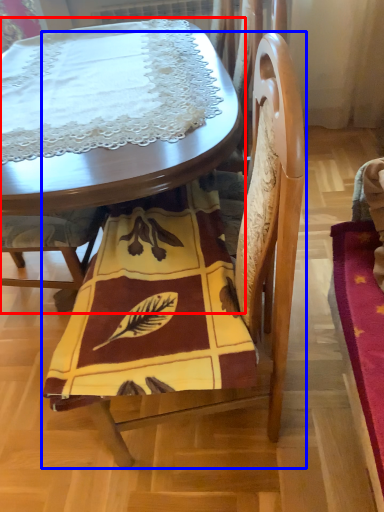
Question: Which of the following is the closest to the observer, table (highlighted by a red box) or chair (highlighted by a blue box)?

Choices:
 (A) table
 (B) chair

Answer: (B)